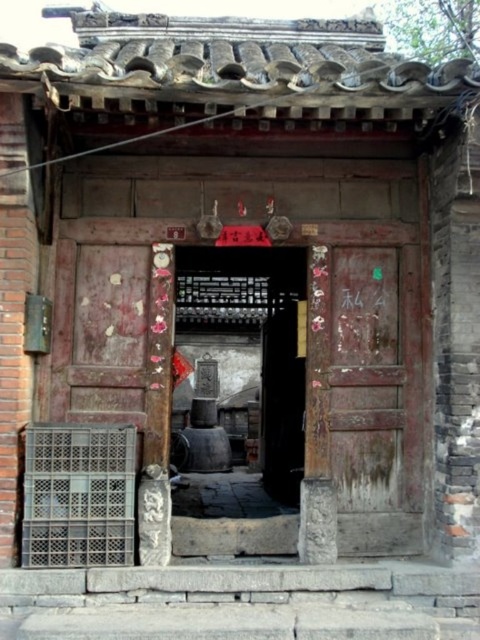
You are a delivery person standing at the entrance of the building. You need to deliver a package to the white paper at center, which is 1.5 meters wide. Can you reach it without moving past the wooden door at center? Please explain.

The distance between the wooden door at center and the white paper at center is 7.19 meters. Since the package needs to reach the white paper at center which is 1.5 meters wide, you would need to extend or move forward 7.19 meters beyond the wooden door at center to place it correctly. Therefore, you cannot reach it without moving past the wooden door at center.

You are a painter who needs to hang a new banner. You have a white paper at center and a wooden door at center. Which object is taller so you can decide where to place the banner?

The wooden door at center is taller than the white paper at center, so you should place the banner on the wooden door at center to ensure it fits properly.

You are standing at the entrance of this traditional Chinese building and notice two points marked on the roof tiles. The first point is located at coordinates point (265, 420), and the second is at point (363, 467). From your perspective, which point is closer to you?

Point (363, 467) is closer to you because it is in front of point (265, 420) according to their spatial arrangement.